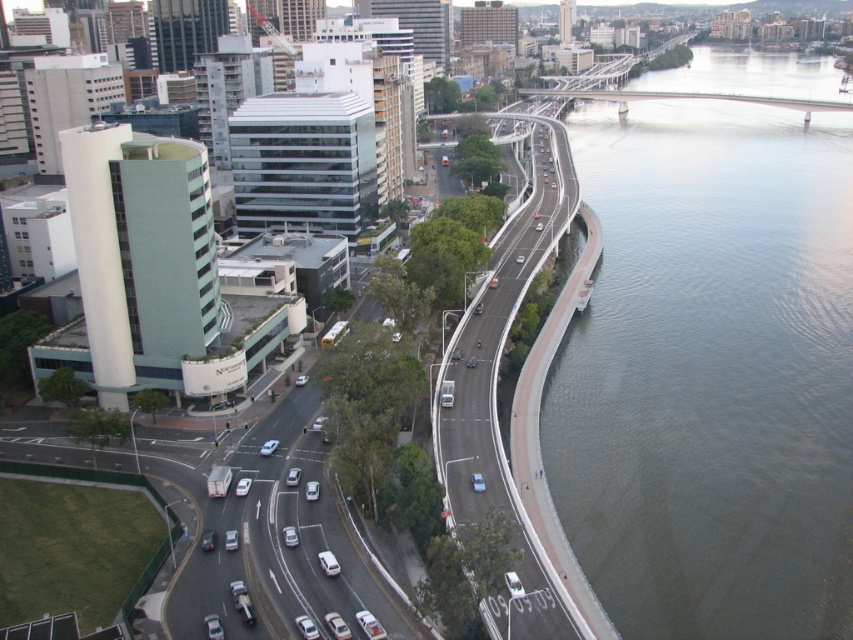
Question: Does dark gray water at right appear over smooth asphalt highway at center right?

Choices:
 (A) yes
 (B) no

Answer: (A)

Question: Does dark gray water at right appear under smooth asphalt highway at center right?

Choices:
 (A) yes
 (B) no

Answer: (B)

Question: Is dark gray water at right bigger than smooth asphalt highway at center right?

Choices:
 (A) yes
 (B) no

Answer: (A)

Question: Among these points, which one is farthest from the camera?

Choices:
 (A) (646, 236)
 (B) (491, 332)

Answer: (A)

Question: Which of the following is the closest to the observer?

Choices:
 (A) (808, 266)
 (B) (473, 400)

Answer: (B)

Question: Among these objects, which one is farthest from the camera?

Choices:
 (A) dark gray water at right
 (B) smooth asphalt highway at center right

Answer: (A)